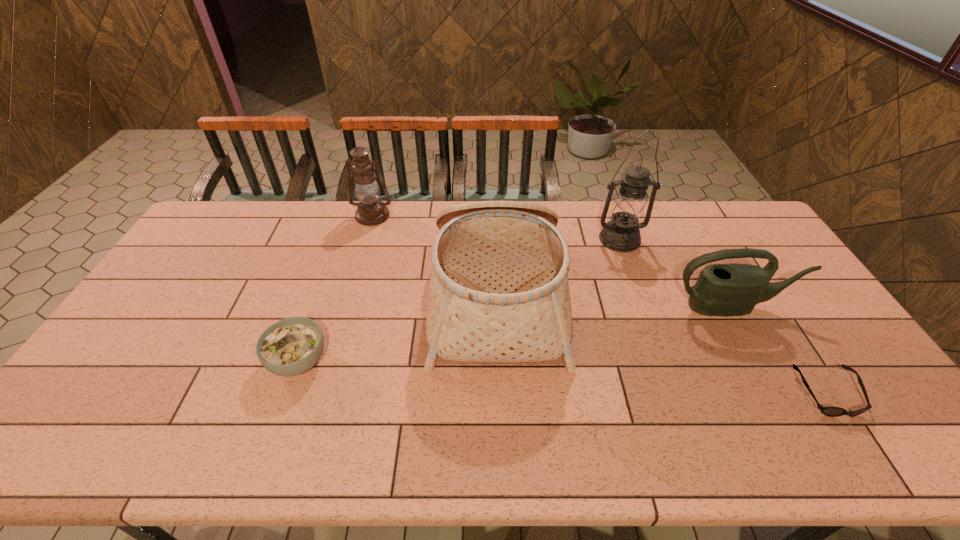
Locate an element on the screen. free location located with the lid open on the fourth object from right to left is located at coordinates click(310, 296).

Where is `vacant position located 0.140m with the lid open on the fourth object from right to left`? vacant position located 0.140m with the lid open on the fourth object from right to left is located at coordinates (386, 296).

Locate an element on the screen. This screenshot has width=960, height=540. vacant space located on the front of the farther oil lamp is located at coordinates (352, 284).

Where is `vacant point located on the spout of the fourth tallest object`? The height and width of the screenshot is (540, 960). vacant point located on the spout of the fourth tallest object is located at coordinates (760, 357).

The image size is (960, 540). Find the location of `free space located 0.210m on the right of the soup bowl`. free space located 0.210m on the right of the soup bowl is located at coordinates (407, 361).

Where is `basket at the far edge`? This screenshot has height=540, width=960. basket at the far edge is located at coordinates (499, 292).

I want to click on watering can that is at the right edge, so click(730, 289).

You are a GUI agent. You are given a task and a screenshot of the screen. Output one action in this format:
    pyautogui.click(x=<x>, y=<y>)
    Task: Click on the sunglasses situated at the right edge
    
    Given the screenshot: What is the action you would take?
    pyautogui.click(x=828, y=411)

You are a GUI agent. You are given a task and a screenshot of the screen. Output one action in this format:
    pyautogui.click(x=<x>, y=<y>)
    Task: Click on the free point at the far edge
    
    Given the screenshot: What is the action you would take?
    pyautogui.click(x=319, y=213)

Locate an element on the screen. The height and width of the screenshot is (540, 960). vacant space at the near edge of the desktop is located at coordinates (554, 452).